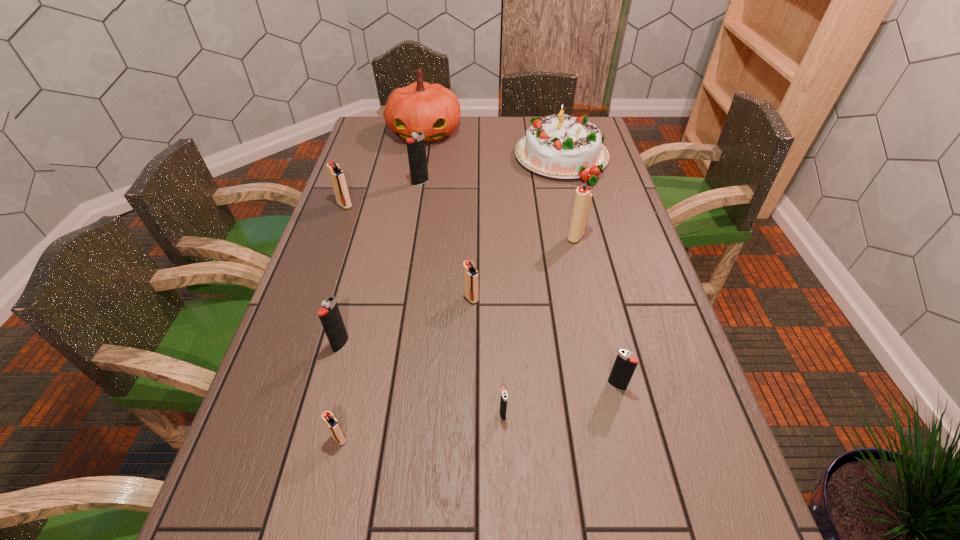
I want to click on cake situated at the far edge, so (562, 146).

Locate an element on the screen. Image resolution: width=960 pixels, height=540 pixels. pumpkin present at the left edge is located at coordinates (432, 109).

What are the coordinates of `cake located at the right edge` in the screenshot? It's located at (562, 146).

Where is `object at the far left corner`? The width and height of the screenshot is (960, 540). object at the far left corner is located at coordinates (432, 109).

This screenshot has width=960, height=540. I want to click on object that is positioned at the far right corner, so click(x=562, y=146).

Image resolution: width=960 pixels, height=540 pixels. In order to click on vacant area at the far edge in this screenshot , I will do `click(492, 135)`.

Locate an element on the screen. This screenshot has height=540, width=960. free spot at the left edge of the desktop is located at coordinates (286, 476).

Locate an element on the screen. free space at the right edge of the desktop is located at coordinates (651, 310).

I want to click on vacant space at the far left corner of the desktop, so click(391, 134).

Image resolution: width=960 pixels, height=540 pixels. In order to click on blank region between the biggest black igniter and the cake in this screenshot , I will do `click(492, 171)`.